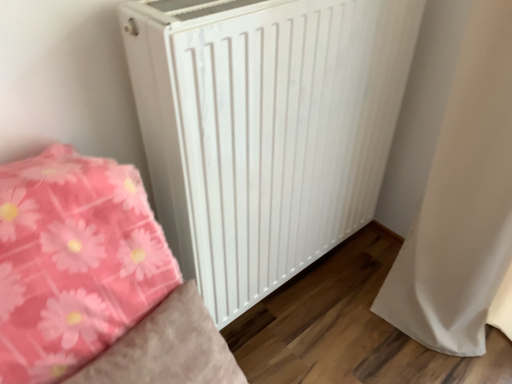
Question: Considering the positions of point (444, 279) and point (220, 160), is point (444, 279) closer or farther from the camera than point (220, 160)?

Choices:
 (A) closer
 (B) farther

Answer: (B)

Question: Visually, is white fabric curtain at right positioned to the left or to the right of white matte radiator at center?

Choices:
 (A) right
 (B) left

Answer: (A)

Question: From the image's perspective, relative to white matte radiator at center, is white fabric curtain at right above or below?

Choices:
 (A) below
 (B) above

Answer: (A)

Question: Is white matte radiator at center wider or thinner than white fabric curtain at right?

Choices:
 (A) thin
 (B) wide

Answer: (A)

Question: In the image, is white matte radiator at center on the left side or the right side of white fabric curtain at right?

Choices:
 (A) right
 (B) left

Answer: (B)

Question: In terms of height, does white matte radiator at center look taller or shorter compared to white fabric curtain at right?

Choices:
 (A) short
 (B) tall

Answer: (A)

Question: Choose the correct answer: Is white matte radiator at center inside white fabric curtain at right or outside it?

Choices:
 (A) outside
 (B) inside

Answer: (A)